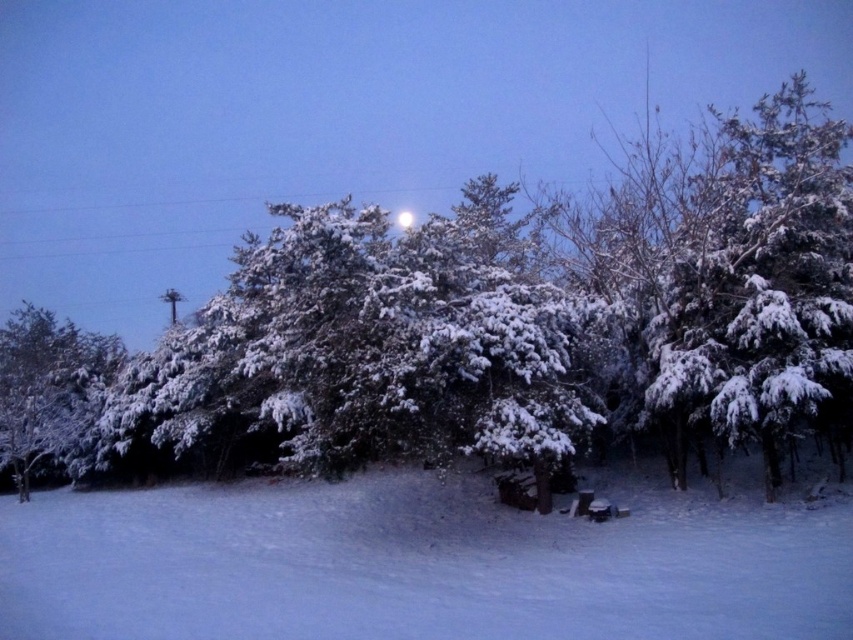
Does snow-covered evergreen at center lie in front of white fluffy snow at lower center?

No, snow-covered evergreen at center is behind white fluffy snow at lower center.

Between snow-covered evergreen at center and white fluffy snow at lower center, which one has less height?

With less height is white fluffy snow at lower center.

The height and width of the screenshot is (640, 853). What do you see at coordinates (486, 324) in the screenshot?
I see `snow-covered evergreen at center` at bounding box center [486, 324].

At what (x,y) coordinates should I click in order to perform the action: click on snow-covered evergreen at center. Please return your answer as a coordinate pair (x, y). This screenshot has width=853, height=640. Looking at the image, I should click on (486, 324).